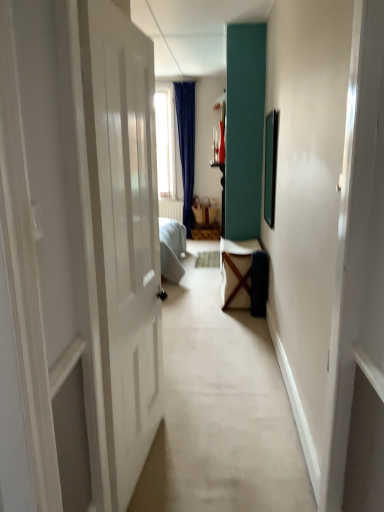
Question: From the image's perspective, is brown woven basket at center, which is the first furniture in top-to-bottom order, above or below wooden chair at center, the first furniture positioned from the bottom?

Choices:
 (A) below
 (B) above

Answer: (B)

Question: Is brown woven basket at center, which is the first furniture in top-to-bottom order, to the left or to the right of wooden chair at center, the first furniture positioned from the bottom, in the image?

Choices:
 (A) right
 (B) left

Answer: (B)

Question: Considering the positions of brown woven basket at center, which is the first furniture in top-to-bottom order, and wooden chair at center, the first furniture positioned from the bottom, in the image, is brown woven basket at center, which is the first furniture in top-to-bottom order, bigger or smaller than wooden chair at center, the first furniture positioned from the bottom,?

Choices:
 (A) small
 (B) big

Answer: (A)

Question: From a real-world perspective, is wooden chair at center, the first furniture positioned from the bottom, physically located above or below brown woven basket at center, which appears as the second furniture when viewed from the front?

Choices:
 (A) below
 (B) above

Answer: (A)

Question: In the image, is wooden chair at center, the first furniture positioned from the bottom, on the left side or the right side of brown woven basket at center, which appears as the second furniture when viewed from the front?

Choices:
 (A) right
 (B) left

Answer: (A)

Question: From their relative heights in the image, would you say wooden chair at center, the 2th furniture in the top-to-bottom sequence, is taller or shorter than brown woven basket at center, which is the first furniture in top-to-bottom order?

Choices:
 (A) tall
 (B) short

Answer: (A)

Question: Is wooden chair at center, marked as the 1th furniture in a front-to-back arrangement, inside the boundaries of brown woven basket at center, which is the first furniture in top-to-bottom order, or outside?

Choices:
 (A) outside
 (B) inside

Answer: (A)